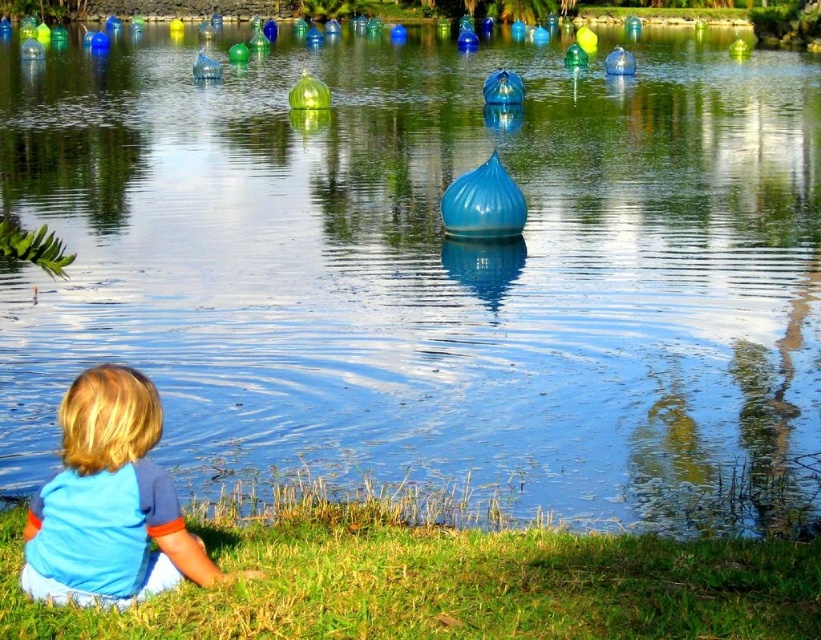
Question: Does green grass at lower left come behind blue cotton shirt at lower left?

Choices:
 (A) yes
 (B) no

Answer: (B)

Question: Which of the following is the farthest from the observer?

Choices:
 (A) green grass at lower left
 (B) blue cotton shirt at lower left

Answer: (B)

Question: Can you confirm if green grass at lower left is wider than blue cotton shirt at lower left?

Choices:
 (A) no
 (B) yes

Answer: (B)

Question: In this image, where is green grass at lower left located relative to blue cotton shirt at lower left?

Choices:
 (A) below
 (B) above

Answer: (A)